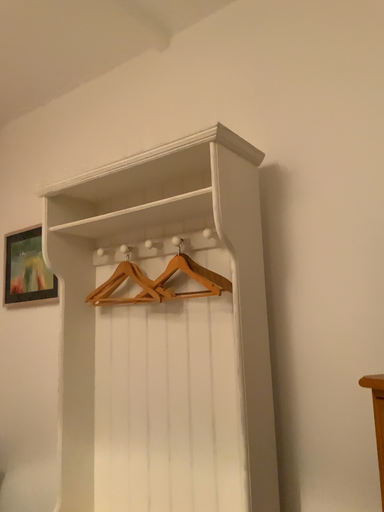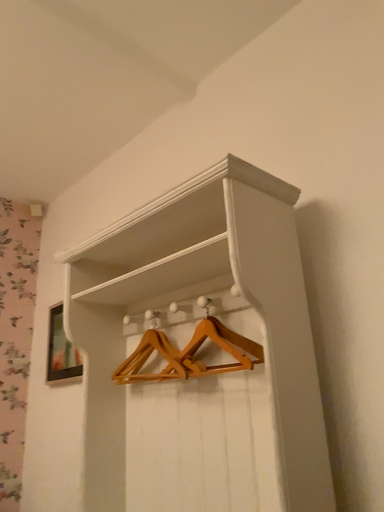
Question: How did the camera likely rotate when shooting the video?

Choices:
 (A) rotated downward
 (B) rotated upward

Answer: (B)